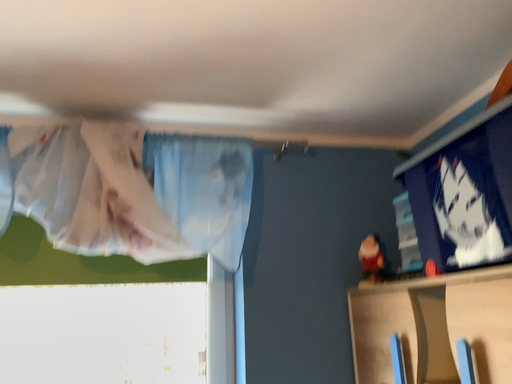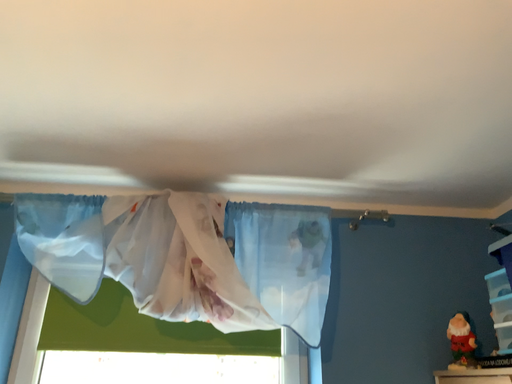
Question: How did the camera likely rotate when shooting the video?

Choices:
 (A) rotated right
 (B) rotated left

Answer: (B)